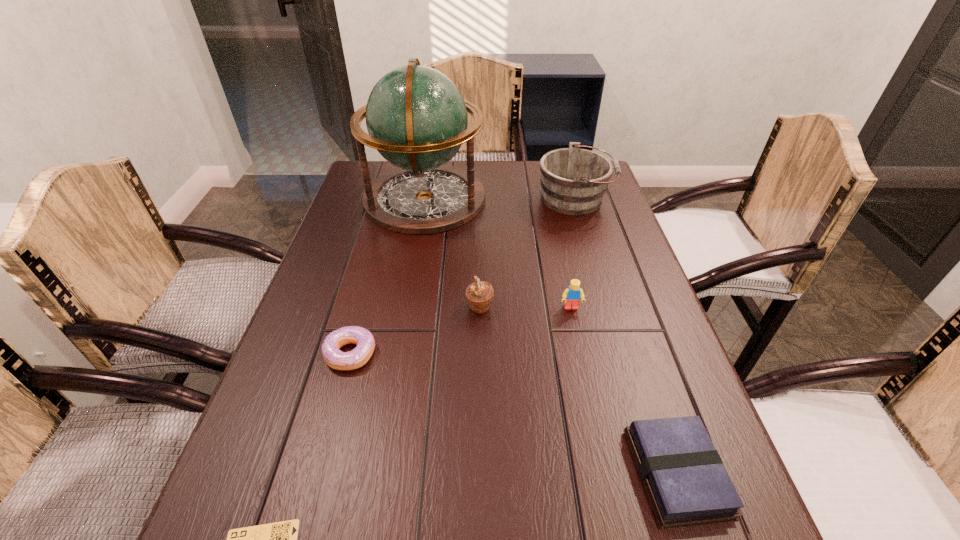
Where is `free space located 0.220m on the right of the doughnut`? The width and height of the screenshot is (960, 540). free space located 0.220m on the right of the doughnut is located at coordinates (479, 354).

I want to click on free space located on the left of the book, so click(x=604, y=473).

Where is `globe that is at the far edge`? The height and width of the screenshot is (540, 960). globe that is at the far edge is located at coordinates (416, 117).

Where is `wine bucket present at the far edge`? The image size is (960, 540). wine bucket present at the far edge is located at coordinates (573, 180).

You are a GUI agent. You are given a task and a screenshot of the screen. Output one action in this format:
    pyautogui.click(x=<x>, y=<y>)
    Task: Click on the globe present at the left edge
    This screenshot has height=540, width=960.
    Given the screenshot: What is the action you would take?
    pyautogui.click(x=416, y=117)

This screenshot has height=540, width=960. I want to click on doughnut situated at the left edge, so click(359, 356).

Locate an element on the screen. wine bucket that is at the right edge is located at coordinates (573, 180).

Identify the location of book present at the right edge. (687, 483).

The width and height of the screenshot is (960, 540). What are the coordinates of `object that is at the far left corner` in the screenshot? It's located at (416, 117).

The width and height of the screenshot is (960, 540). Identify the location of object located at the far right corner. (573, 180).